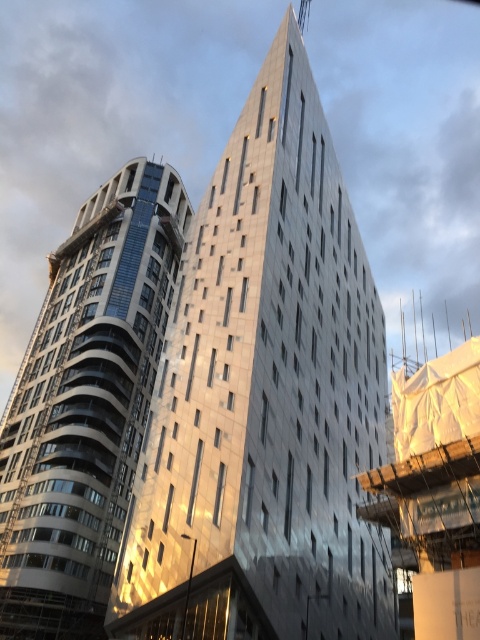
Question: Is metallic silver building at center positioned at the back of metallic glass tower at left?

Choices:
 (A) yes
 (B) no

Answer: (B)

Question: Which object is closer to the camera taking this photo?

Choices:
 (A) metallic silver building at center
 (B) metallic glass tower at left

Answer: (A)

Question: Can you confirm if metallic silver building at center is smaller than metallic glass tower at left?

Choices:
 (A) no
 (B) yes

Answer: (A)

Question: Is metallic silver building at center to the left of metallic glass tower at left from the viewer's perspective?

Choices:
 (A) yes
 (B) no

Answer: (B)